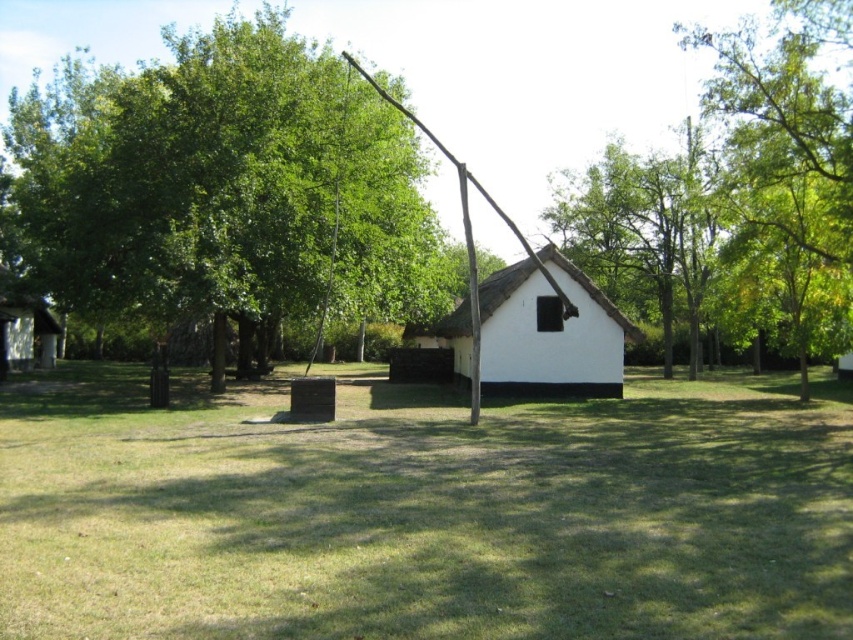
Question: Can you confirm if green leafy tree at upper center is positioned to the left of white thatch hut at center?

Choices:
 (A) yes
 (B) no

Answer: (B)

Question: Which point appears farthest from the camera in this image?

Choices:
 (A) (589, 253)
 (B) (450, 344)
 (C) (9, 342)

Answer: (A)

Question: Which point appears closest to the camera in this image?

Choices:
 (A) (521, 364)
 (B) (132, 298)

Answer: (B)

Question: Is green leafy tree at upper left above green leafy tree at upper right?

Choices:
 (A) no
 (B) yes

Answer: (A)

Question: Does white thatch hut at center appear under wooden hut at lower left?

Choices:
 (A) no
 (B) yes

Answer: (A)

Question: Which is farther from the green leafy tree at upper right?

Choices:
 (A) green leafy tree at upper left
 (B) green leafy tree at upper center
 (C) wooden hut at lower left
 (D) white thatch hut at center

Answer: (C)